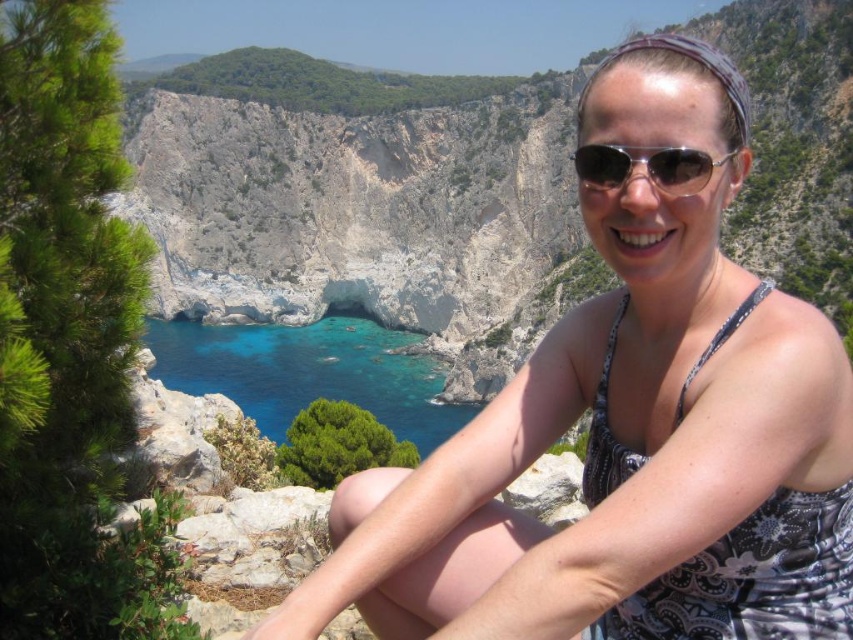
You are a photographer planning to take a portrait of the person in the scene. You want to ensure that both the white printed dress at center and the sunglasses at center are clearly visible in the photo. Given their size difference, which object should you focus on to ensure both are in focus?

The white printed dress at center is larger than the sunglasses at center. To ensure both are in focus, you should focus on the white printed dress at center since it is the larger object and will require more precise focusing to capture details.